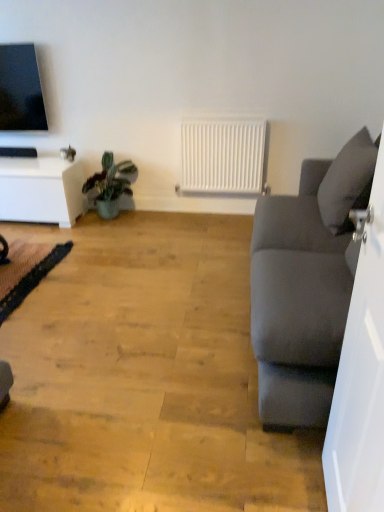
Question: From their relative heights in the image, would you say white glossy table at left is taller or shorter than matte gray couch at right?

Choices:
 (A) tall
 (B) short

Answer: (B)

Question: Do you think white glossy table at left is within matte gray couch at right, or outside of it?

Choices:
 (A) outside
 (B) inside

Answer: (A)

Question: Estimate the real-world distances between objects in this image. Which object is farther from the black lace yoga mat at lower left?

Choices:
 (A) green matte plant at lower left
 (B) white matte radiator at center
 (C) white glossy table at left
 (D) matte gray couch at right
 (E) gray fabric pillow at right

Answer: (E)

Question: Considering the real-world distances, which object is farthest from the white glossy table at left?

Choices:
 (A) green matte plant at lower left
 (B) black lace yoga mat at lower left
 (C) gray fabric pillow at right
 (D) matte gray couch at right
 (E) white matte radiator at center

Answer: (C)